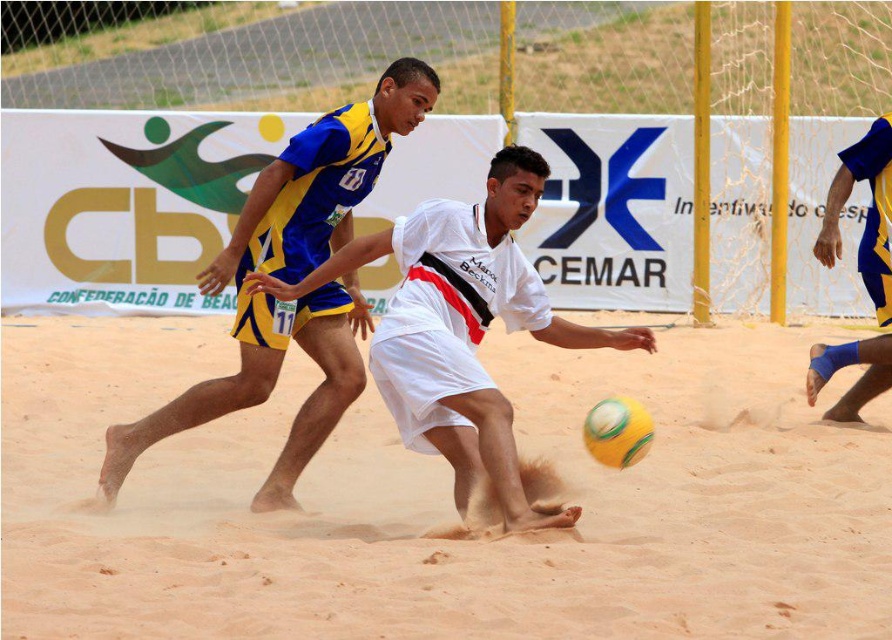
Question: Which of the following is the closest to the observer?

Choices:
 (A) blue/yellow jersey at center
 (B) white matte jersey at center
 (C) fine-grained sand at center
 (D) blue/yellow jersey at right

Answer: (B)

Question: Which of the following is the farthest from the observer?

Choices:
 (A) blue/yellow jersey at right
 (B) blue/yellow jersey at center
 (C) white matte jersey at center

Answer: (A)

Question: Among these objects, which one is farthest from the camera?

Choices:
 (A) blue/yellow jersey at right
 (B) fine-grained sand at center
 (C) white matte jersey at center
 (D) yellow-green textured volleyball at center

Answer: (A)

Question: Does fine-grained sand at center appear on the right side of white matte jersey at center?

Choices:
 (A) no
 (B) yes

Answer: (A)

Question: Is blue/yellow jersey at center closer to the viewer compared to blue/yellow jersey at right?

Choices:
 (A) yes
 (B) no

Answer: (A)

Question: Does fine-grained sand at center come behind blue/yellow jersey at center?

Choices:
 (A) no
 (B) yes

Answer: (B)